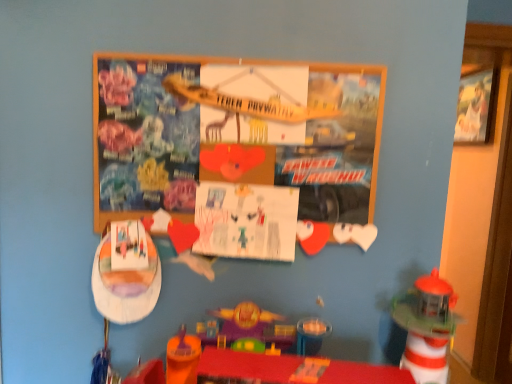
Question: Would you say white paper at center is part of wooden bulletin board at center's contents?

Choices:
 (A) no
 (B) yes

Answer: (B)

Question: Is wooden bulletin board at center completely or partially outside of white paper at center?

Choices:
 (A) yes
 (B) no

Answer: (A)

Question: Considering the relative sizes of wooden bulletin board at center and white paper at center in the image provided, is wooden bulletin board at center taller than white paper at center?

Choices:
 (A) no
 (B) yes

Answer: (B)

Question: Does wooden bulletin board at center have a greater width compared to white paper at center?

Choices:
 (A) no
 (B) yes

Answer: (B)

Question: Considering the relative sizes of wooden bulletin board at center and white paper at center in the image provided, is wooden bulletin board at center bigger than white paper at center?

Choices:
 (A) no
 (B) yes

Answer: (B)

Question: Considering the positions of point (115, 292) and point (470, 104), is point (115, 292) closer or farther from the camera than point (470, 104)?

Choices:
 (A) closer
 (B) farther

Answer: (A)

Question: Is wooden boat at lower left, the 2th toy from the right, wider or thinner than wooden picture frame at upper right?

Choices:
 (A) wide
 (B) thin

Answer: (B)

Question: Considering the positions of wooden boat at lower left, the 2th toy from the right, and wooden picture frame at upper right in the image, is wooden boat at lower left, the 2th toy from the right, bigger or smaller than wooden picture frame at upper right?

Choices:
 (A) big
 (B) small

Answer: (B)

Question: Based on their positions, is wooden boat at lower left, the first toy when ordered from left to right, located to the left or right of wooden picture frame at upper right?

Choices:
 (A) left
 (B) right

Answer: (A)

Question: Considering their positions, is wooden boat at lower left, the 2th toy from the right, located in front of or behind wooden bulletin board at center?

Choices:
 (A) front
 (B) behind

Answer: (B)

Question: Based on their positions, is wooden boat at lower left, the 2th toy from the right, located to the left or right of wooden bulletin board at center?

Choices:
 (A) left
 (B) right

Answer: (A)

Question: Is point (137, 279) positioned closer to the camera than point (296, 74)?

Choices:
 (A) farther
 (B) closer

Answer: (A)

Question: From a real-world perspective, is wooden boat at lower left, the 2th toy from the right, above or below wooden bulletin board at center?

Choices:
 (A) above
 (B) below

Answer: (B)

Question: Considering the positions of wooden boat at lower left, the first toy when ordered from left to right, and translucent plastic lighthouse at lower right, the 2th toy positioned from the left, in the image, is wooden boat at lower left, the first toy when ordered from left to right, taller or shorter than translucent plastic lighthouse at lower right, the 2th toy positioned from the left,?

Choices:
 (A) tall
 (B) short

Answer: (B)

Question: Is wooden boat at lower left, the 2th toy from the right, wider or thinner than translucent plastic lighthouse at lower right, placed as the 1th toy when sorted from right to left?

Choices:
 (A) thin
 (B) wide

Answer: (A)